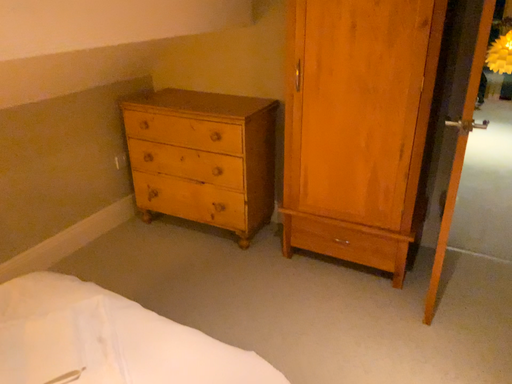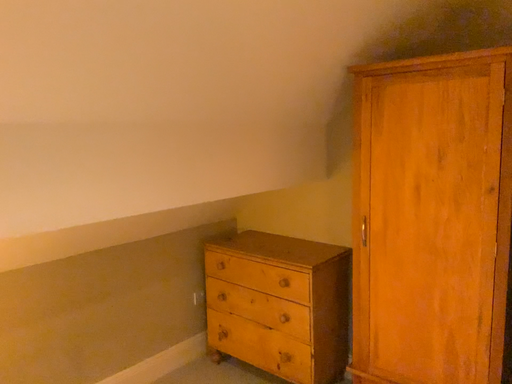
Question: Which way did the camera rotate in the video?

Choices:
 (A) rotated downward
 (B) rotated upward

Answer: (B)